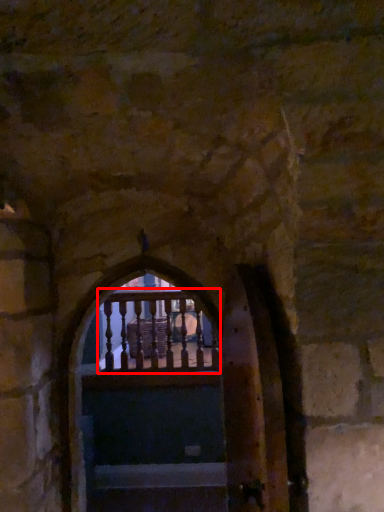
Question: From the image's perspective, what is the correct spatial positioning of balcony (annotated by the red box) in reference to stairs?

Choices:
 (A) above
 (B) below

Answer: (A)